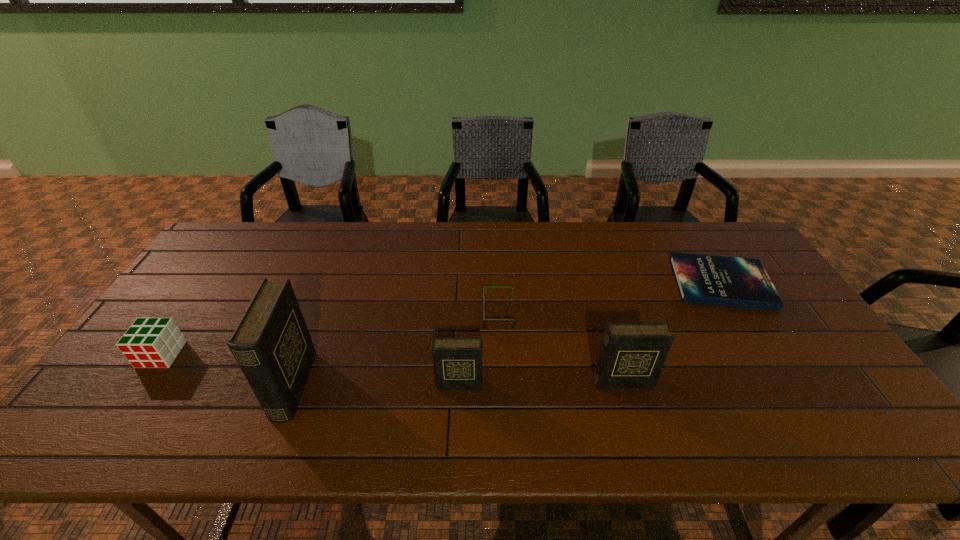
Identify the location of the second shortest object. The height and width of the screenshot is (540, 960). (484, 319).

Where is `spectacles`? The width and height of the screenshot is (960, 540). spectacles is located at coordinates (484, 319).

The height and width of the screenshot is (540, 960). I want to click on free location located 0.080m on the front cover of the tallest object, so click(x=338, y=386).

Image resolution: width=960 pixels, height=540 pixels. What are the coordinates of `free space located 0.200m on the left of the hardback book` in the screenshot? It's located at (608, 283).

What are the coordinates of `free space located on the red face of the third shortest object` in the screenshot? It's located at (128, 403).

You are a GUI agent. You are given a task and a screenshot of the screen. Output one action in this format:
    pyautogui.click(x=<x>, y=<y>)
    Task: Click on the free space located on the lens of the third object from right to left
    This screenshot has width=960, height=540.
    Given the screenshot: What is the action you would take?
    tap(409, 314)

At what (x,y) coordinates should I click in order to perform the action: click on vacant point located 0.170m on the lens of the third object from right to left. Please return your answer as a coordinate pair (x, y). The width and height of the screenshot is (960, 540). Looking at the image, I should click on (423, 314).

Identify the location of vacant space situated 0.160m on the lens of the third object from right to left. (427, 314).

Find the location of a particular element. object present at the far edge is located at coordinates (727, 281).

Find the location of `object present at the left edge`. object present at the left edge is located at coordinates (150, 342).